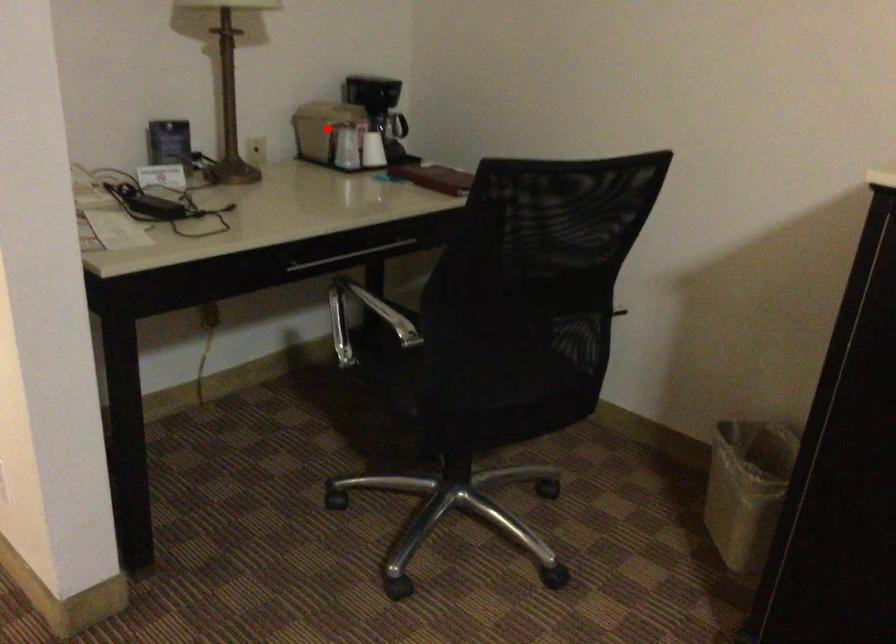
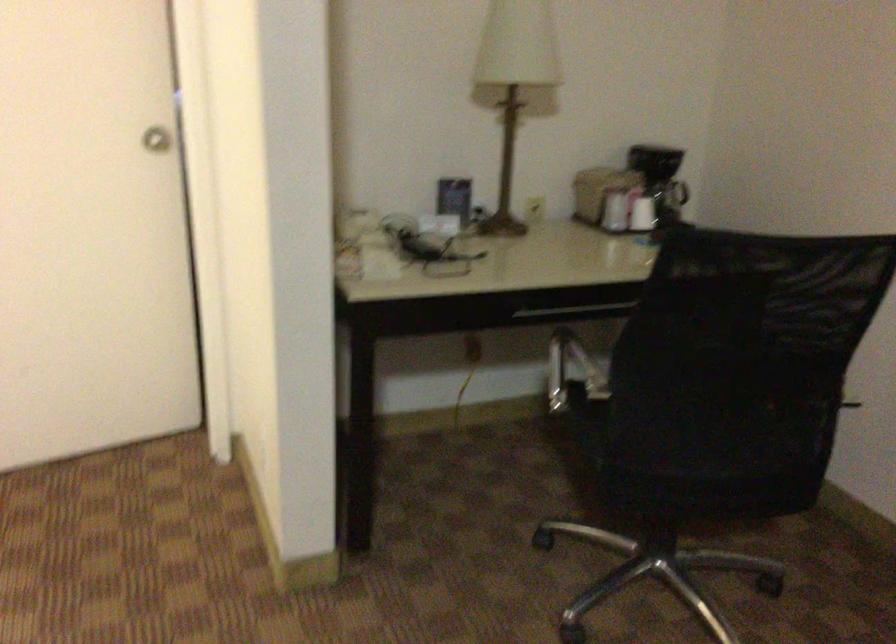
Locate, in the second image, the point that corresponds to the highlighted location in the first image.

(599, 190)